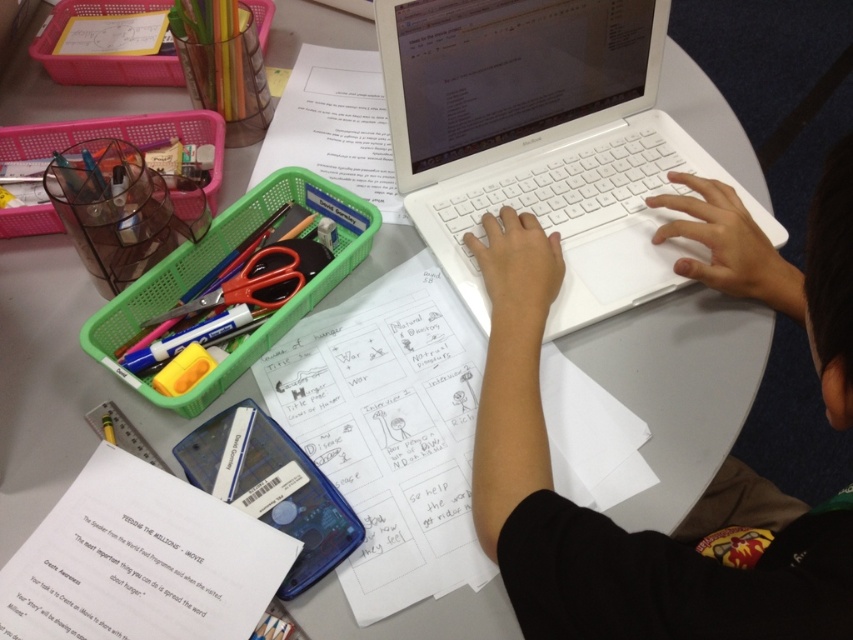
Between white paper at center and white paper at upper center, which one appears on the left side from the viewer's perspective?

white paper at upper center

Does point (561, 428) lie behind point (366, 147)?

No, it is in front of (366, 147).

This screenshot has width=853, height=640. What are the coordinates of `white paper at center` in the screenshot? It's located at (390, 429).

Between point (196, 250) and point (263, 278), which one is positioned in front?

Positioned in front is point (263, 278).

Between translucent plastic tray at left and red plastic scissors at upper left, which one is positioned lower?

red plastic scissors at upper left

What do you see at coordinates (209, 268) in the screenshot? This screenshot has height=640, width=853. I see `translucent plastic tray at left` at bounding box center [209, 268].

At what (x,y) coordinates should I click in order to perform the action: click on translucent plastic tray at left. Please return your answer as a coordinate pair (x, y). Looking at the image, I should click on (209, 268).

Based on the photo, which is more to the left, translucent plastic tray at left or white paper at upper center?

Positioned to the left is translucent plastic tray at left.

Which is below, translucent plastic tray at left or white paper at upper center?

translucent plastic tray at left is below.

Describe the element at coordinates (209, 268) in the screenshot. The height and width of the screenshot is (640, 853). I see `translucent plastic tray at left` at that location.

Find the location of `translucent plastic tray at left`. translucent plastic tray at left is located at coordinates (209, 268).